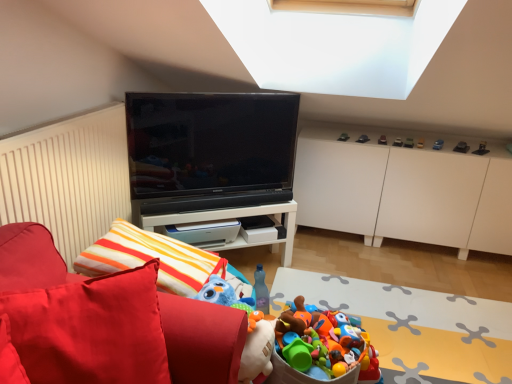
Identify the location of free space behind metallic silver toy car at upper right, acting as the 3th toy starting from the left. (342, 128).